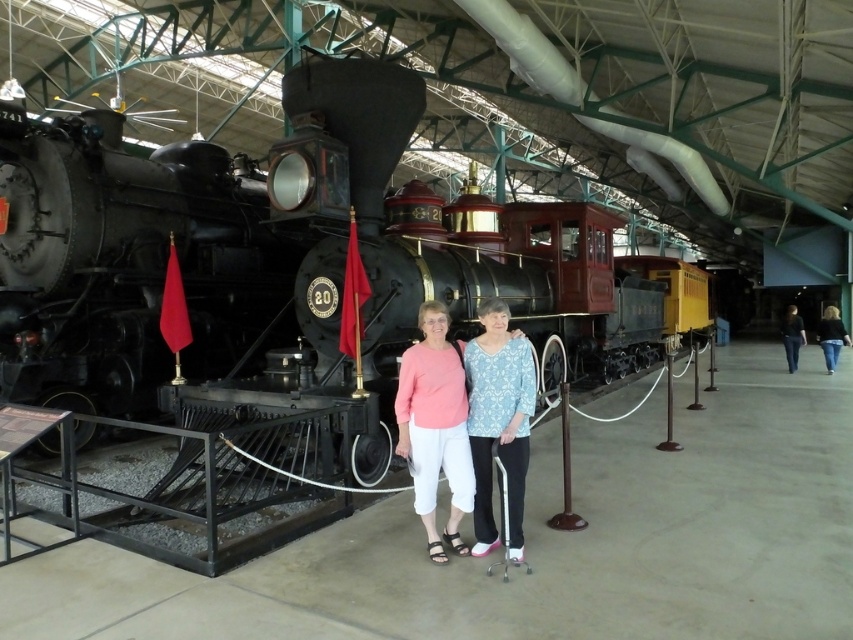
Question: Which object is farther from the camera taking this photo?

Choices:
 (A) matte pink blouse at center
 (B) black leather pants at right

Answer: (B)

Question: Which object is the farthest from the polished black locomotive at center?

Choices:
 (A) polished black steam locomotive at left
 (B) blue printed blouse at center

Answer: (B)

Question: Considering the relative positions of polished black steam locomotive at left and matte pink blouse at center in the image provided, where is polished black steam locomotive at left located with respect to matte pink blouse at center?

Choices:
 (A) below
 (B) above

Answer: (B)

Question: Does blue printed blouse at center appear under black leather pants at right?

Choices:
 (A) yes
 (B) no

Answer: (A)

Question: Which of these objects is positioned farthest from the black leather pants at right?

Choices:
 (A) polished black locomotive at center
 (B) blue printed blouse at center
 (C) jeans at right
 (D) matte pink blouse at center

Answer: (B)

Question: Does polished black steam locomotive at left appear under black leather pants at right?

Choices:
 (A) yes
 (B) no

Answer: (B)